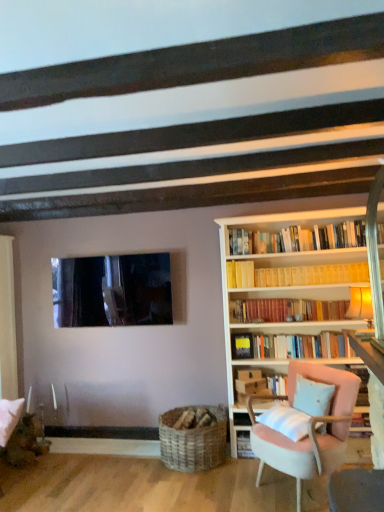
This screenshot has height=512, width=384. Find the location of `free space to the left of pink fabric chair at right`. free space to the left of pink fabric chair at right is located at coordinates (217, 489).